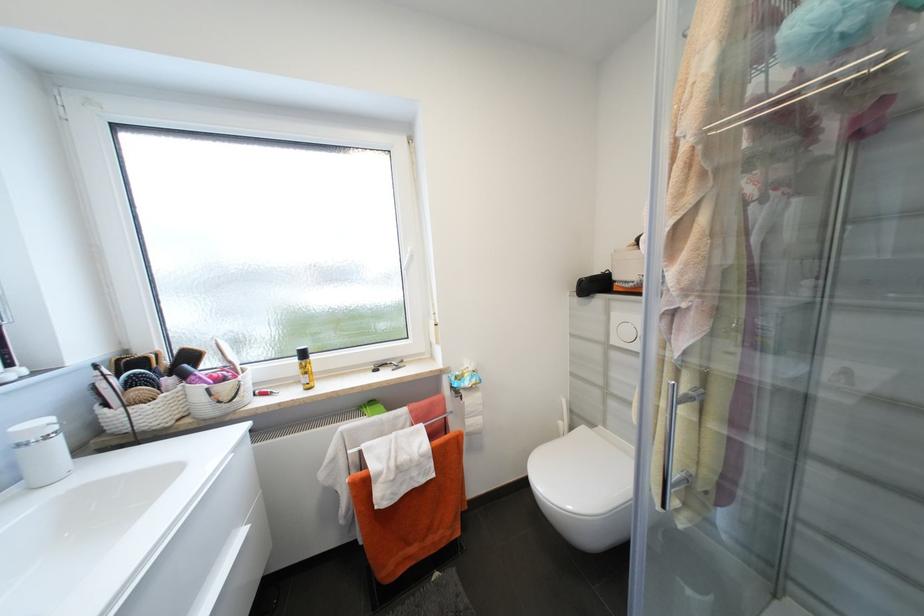
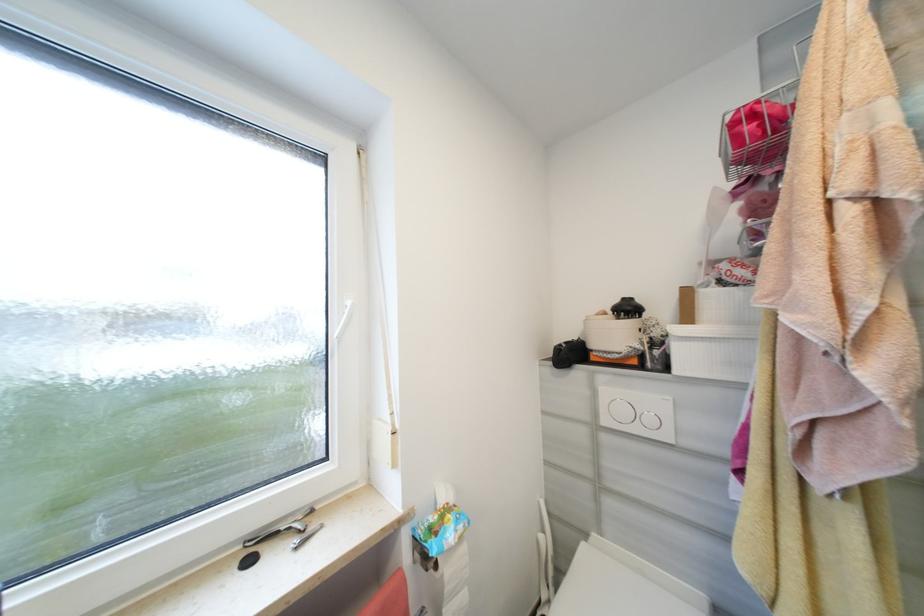
Based on the photo, the images are taken continuously from a first-person perspective. In which direction are you moving?

The movement direction of the cameraman is left, forward.